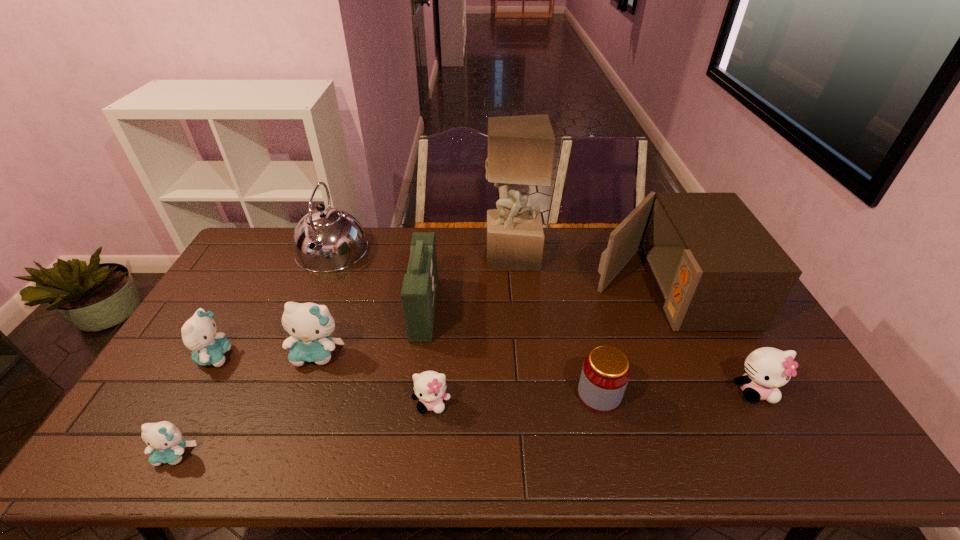
Where is `free space that is in between the nearest kitten and the red jar`? The image size is (960, 540). free space that is in between the nearest kitten and the red jar is located at coordinates (387, 424).

This screenshot has height=540, width=960. In order to click on vacant space in between the red jar and the kettle in this screenshot , I will do `click(465, 323)`.

I want to click on object that can be found as the eighth closest to the red jar, so click(x=165, y=443).

The width and height of the screenshot is (960, 540). Find the location of `object that is the sixth closest to the smallest blue kitten`. object that is the sixth closest to the smallest blue kitten is located at coordinates (605, 373).

Identify which kitten is the third closest to the seventh object from left to right. Please provide its 2D coordinates. Your answer should be formatted as a tuple, i.e. [(x, y)], where the tuple contains the x and y coordinates of a point satisfying the conditions above.

[(766, 369)]

The height and width of the screenshot is (540, 960). Find the location of `kitten identified as the third closest to the second smallest blue kitten`. kitten identified as the third closest to the second smallest blue kitten is located at coordinates (429, 386).

Locate which blue kitten is the second closest to the microwave oven. Please provide its 2D coordinates. Your answer should be formatted as a tuple, i.e. [(x, y)], where the tuple contains the x and y coordinates of a point satisfying the conditions above.

[(199, 335)]

Locate which blue kitten is the second closest to the gray sculpture. Please provide its 2D coordinates. Your answer should be formatted as a tuple, i.e. [(x, y)], where the tuple contains the x and y coordinates of a point satisfying the conditions above.

[(199, 335)]

Where is `blank area in the image that satisfies the following two spatial constraints: 1. on the face of the biggest blue kitten; 2. on the left side of the eighth object from left to right`? The width and height of the screenshot is (960, 540). blank area in the image that satisfies the following two spatial constraints: 1. on the face of the biggest blue kitten; 2. on the left side of the eighth object from left to right is located at coordinates (302, 395).